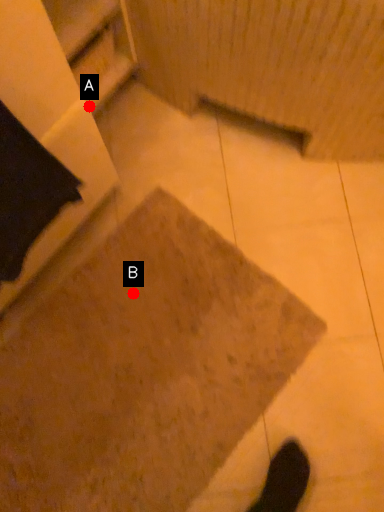
Question: Two points are circled on the image, labeled by A and B beside each circle. Which point is farther from the camera taking this photo?

Choices:
 (A) A is further
 (B) B is further

Answer: (A)